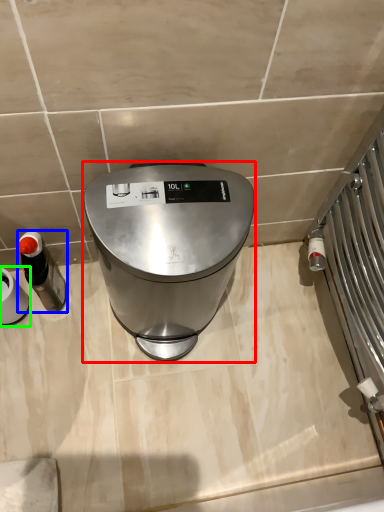
Question: Which object is positioned closest to home appliance (highlighted by a red box)? Select from appliance (highlighted by a blue box) and appliance (highlighted by a green box).

Choices:
 (A) appliance
 (B) appliance

Answer: (A)